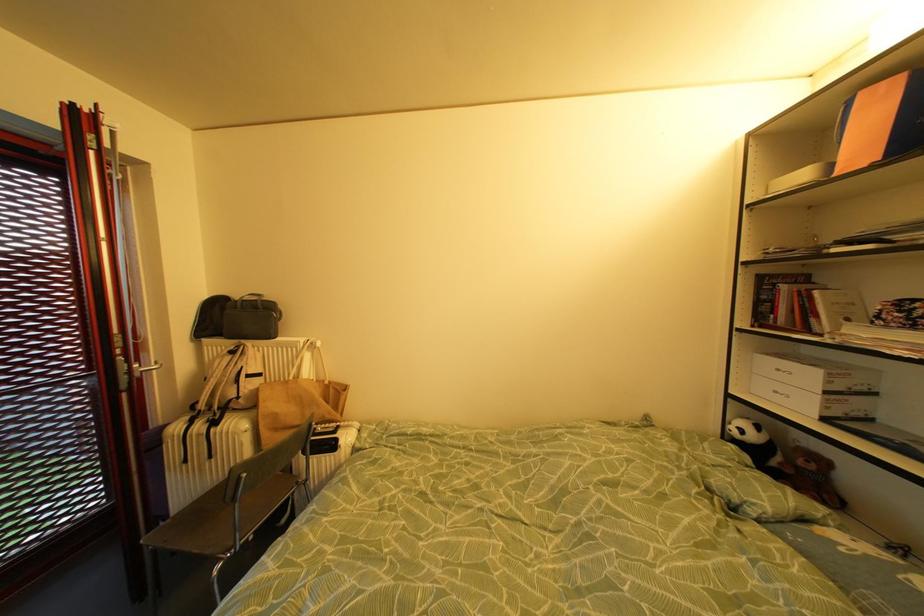
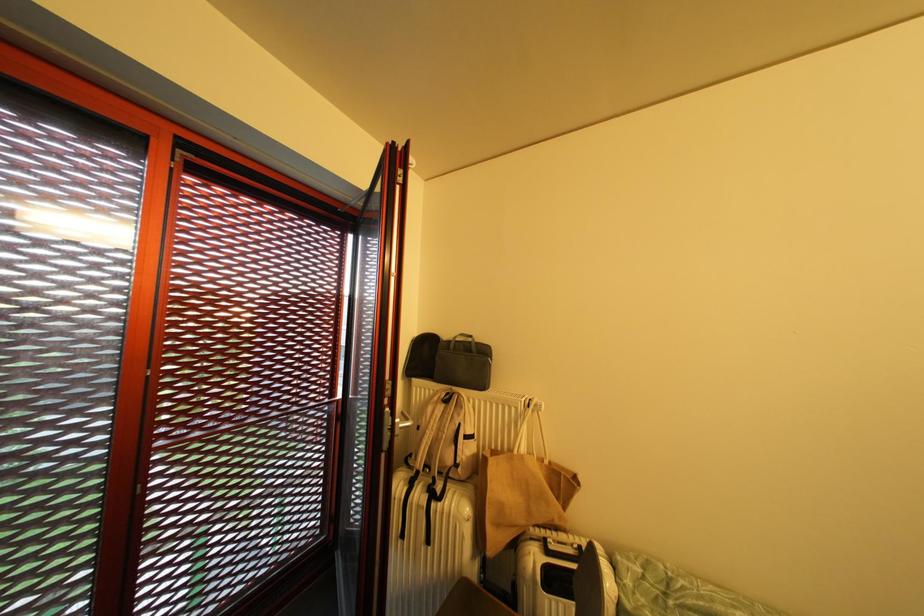
Question: Based on the continuous images, in which direction is the camera rotating? Reply with the corresponding letter.

Choices:
 (A) Left
 (B) Right
 (C) Up
 (D) Down

Answer: (A)